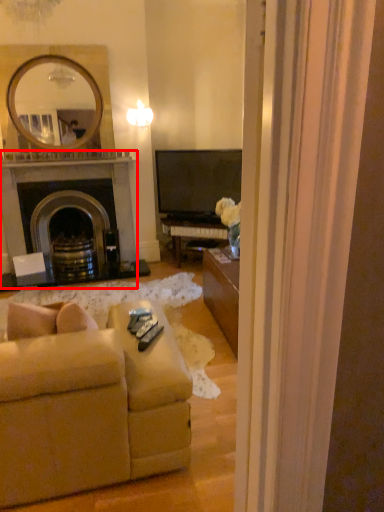
Question: Observing the image, what is the correct spatial positioning of fireplace (annotated by the red box) in reference to studio couch?

Choices:
 (A) left
 (B) right

Answer: (A)